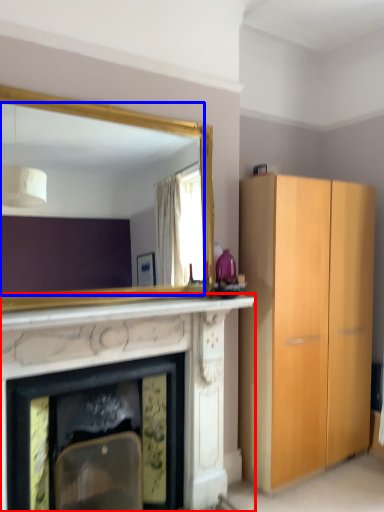
Question: Which of the following is the closest to the observer, fireplace (highlighted by a red box) or mirror (highlighted by a blue box)?

Choices:
 (A) fireplace
 (B) mirror

Answer: (A)